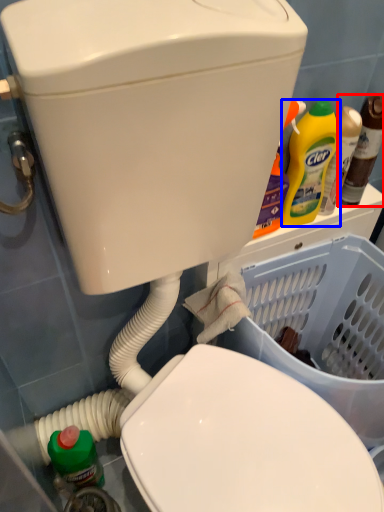
Question: Which point is closer to the camera, bottle (highlighted by a red box) or cleaning product (highlighted by a blue box)?

Choices:
 (A) bottle
 (B) cleaning product

Answer: (B)